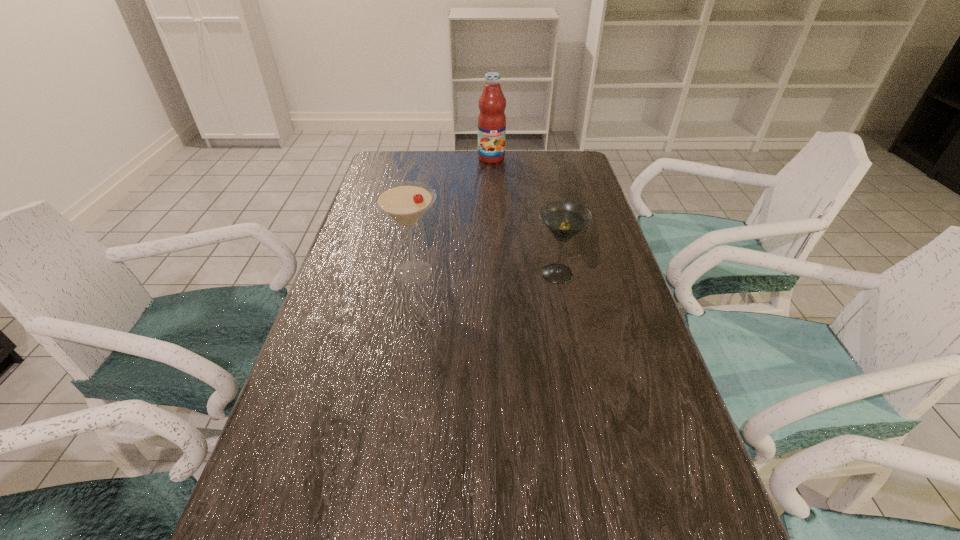
This screenshot has height=540, width=960. I want to click on the farthest object, so click(491, 120).

The image size is (960, 540). Identify the location of fruit juice. (491, 120).

Identify the location of the leftmost object. (405, 202).

The height and width of the screenshot is (540, 960). In order to click on the rightmost object in this screenshot , I will do `click(564, 219)`.

Identify the location of free space located 0.100m on the front label of the farthest object. The height and width of the screenshot is (540, 960). 492,178.

Locate an element on the screen. This screenshot has height=540, width=960. vacant space located 0.290m on the right of the left martini is located at coordinates (553, 272).

Find the location of a particular element. The width and height of the screenshot is (960, 540). blank area located 0.080m on the right of the rightmost object is located at coordinates (612, 274).

Identify the location of object present at the far edge. The image size is (960, 540). (491, 120).

What are the coordinates of `object located in the left edge section of the desktop` in the screenshot? It's located at (405, 202).

At what (x,y) coordinates should I click in order to perform the action: click on object present at the right edge. Please return your answer as a coordinate pair (x, y). The width and height of the screenshot is (960, 540). Looking at the image, I should click on (564, 219).